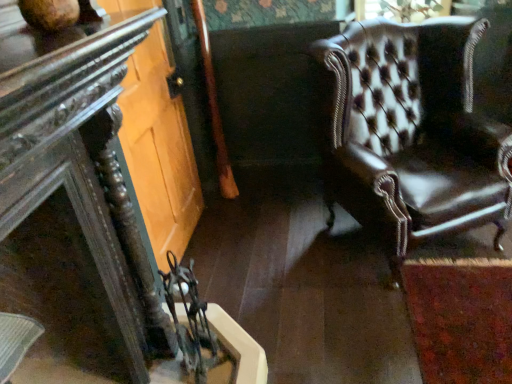
Find the location of a particular element. The width and height of the screenshot is (512, 384). vacant area that lies between leather armchair at right and clear glass door at lower left is located at coordinates (271, 249).